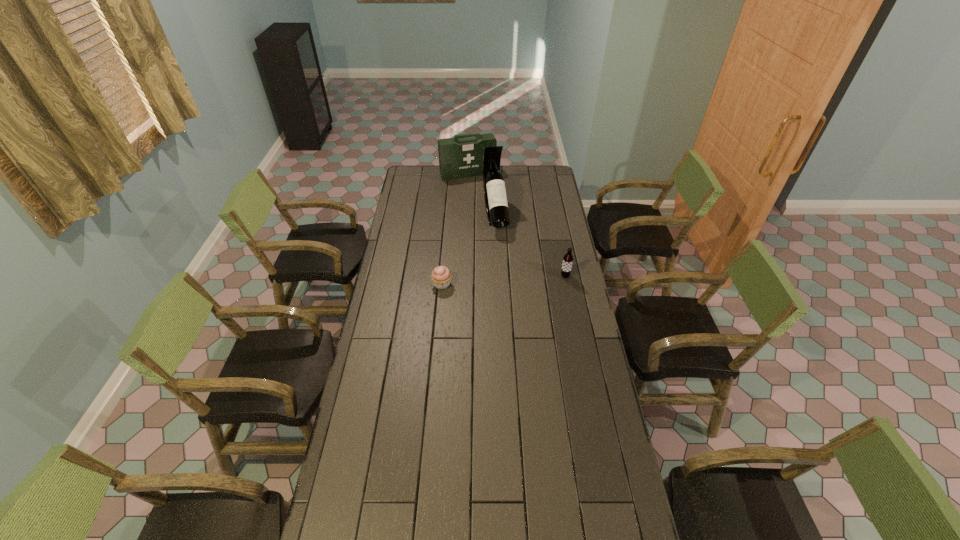
Identify the location of blank area located 0.140m on the stand of the tallest object. The height and width of the screenshot is (540, 960). (503, 255).

At what (x,y) coordinates should I click in order to perform the action: click on free region located on the stand of the tallest object. Please return your answer as a coordinate pair (x, y). This screenshot has height=540, width=960. Looking at the image, I should click on (513, 292).

I want to click on free space located on the front-facing side of the first-aid kit, so click(x=486, y=205).

Where is `vacant space located 0.300m on the front-facing side of the first-aid kit`? The width and height of the screenshot is (960, 540). vacant space located 0.300m on the front-facing side of the first-aid kit is located at coordinates (488, 208).

At what (x,y) coordinates should I click in order to perform the action: click on blank area located 0.250m on the front-facing side of the first-aid kit. Please return your answer as a coordinate pair (x, y). This screenshot has width=960, height=540. Looking at the image, I should click on (485, 204).

Locate an element on the screen. object that is positioned at the far edge is located at coordinates (458, 158).

At what (x,y) coordinates should I click in order to perform the action: click on object that is at the right edge. Please return your answer as a coordinate pair (x, y). Looking at the image, I should click on (567, 263).

At what (x,y) coordinates should I click in order to perform the action: click on vacant area at the far edge of the desktop. Please return your answer as a coordinate pair (x, y). Looking at the image, I should click on coord(446,186).

In the image, there is a desktop. At what (x,y) coordinates should I click in order to perform the action: click on free space at the near edge. Please return your answer as a coordinate pair (x, y). The height and width of the screenshot is (540, 960). Looking at the image, I should click on pyautogui.click(x=540, y=516).

This screenshot has height=540, width=960. Identify the location of vacant space at the left edge of the desktop. (420, 222).